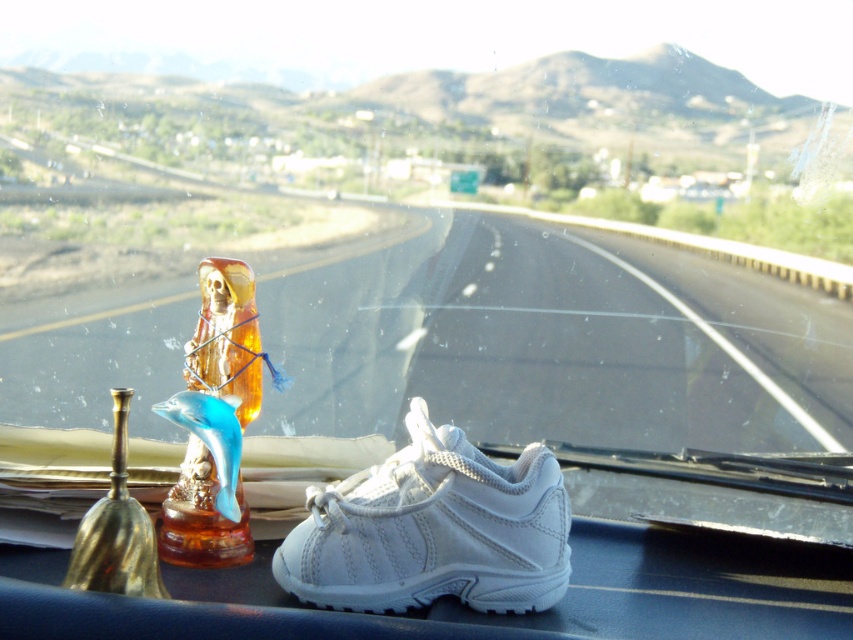
You are driving a car and want to place a new item on the dashboard between the white leather shoe at center and the translucent amber glass figurine at center. Considering their sizes, which one takes up more space horizontally?

The white leather shoe at center takes up more space horizontally than the translucent amber glass figurine at center because its width is larger.

You are driving and need to place a GPS tracker on the dashboard. The GPS tracker requires a clear view of the road ahead and must not be obstructed by the white leather shoe at center. Based on its current position at point 0.828, 0.509, is there enough space to place the GPS tracker next to it without blocking the view?

The white leather shoe at center is located at point (433, 529). Since the GPS tracker needs a clear view and space next to the shoe, it should be placed in an unobstructed area near the shoe without covering the road view.